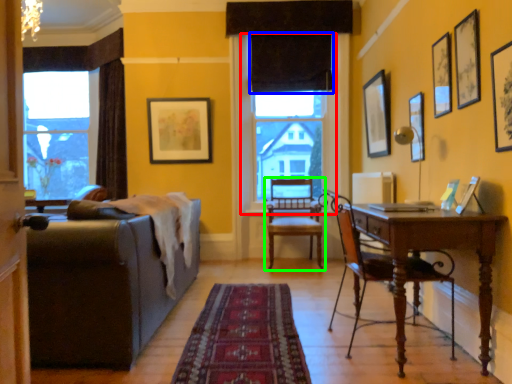
Question: Estimate the real-world distances between objects in this image. Which object is closer to window screen (highlighted by a red box), curtain (highlighted by a blue box) or chair (highlighted by a green box)?

Choices:
 (A) curtain
 (B) chair

Answer: (A)